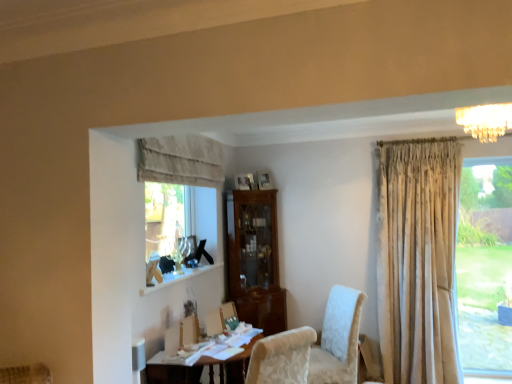
Question: Is wooden table at lower center positioned with its back to neutral fabric curtain at upper center?

Choices:
 (A) no
 (B) yes

Answer: (A)

Question: From the image's perspective, is wooden table at lower center under neutral fabric curtain at upper center?

Choices:
 (A) yes
 (B) no

Answer: (A)

Question: Is the depth of wooden table at lower center less than that of neutral fabric curtain at upper center?

Choices:
 (A) no
 (B) yes

Answer: (B)

Question: Can you confirm if wooden table at lower center is bigger than neutral fabric curtain at upper center?

Choices:
 (A) yes
 (B) no

Answer: (A)

Question: From a real-world perspective, is wooden table at lower center positioned under neutral fabric curtain at upper center based on gravity?

Choices:
 (A) yes
 (B) no

Answer: (A)

Question: Is wooden table at lower center wider or thinner than white textured chair at center?

Choices:
 (A) thin
 (B) wide

Answer: (B)

Question: Do you think wooden table at lower center is within white textured chair at center, or outside of it?

Choices:
 (A) inside
 (B) outside

Answer: (B)

Question: Relative to white textured chair at center, is wooden table at lower center in front or behind?

Choices:
 (A) behind
 (B) front

Answer: (B)

Question: Considering the positions of point (148, 382) and point (326, 332), is point (148, 382) closer or farther from the camera than point (326, 332)?

Choices:
 (A) closer
 (B) farther

Answer: (A)

Question: From their relative heights in the image, would you say neutral fabric curtain at upper center is taller or shorter than wooden table at lower center?

Choices:
 (A) tall
 (B) short

Answer: (B)

Question: Is point (139, 147) closer or farther from the camera than point (179, 380)?

Choices:
 (A) farther
 (B) closer

Answer: (A)

Question: Visually, is neutral fabric curtain at upper center positioned to the left or to the right of wooden table at lower center?

Choices:
 (A) right
 (B) left

Answer: (B)

Question: Considering the positions of neutral fabric curtain at upper center and wooden table at lower center in the image, is neutral fabric curtain at upper center bigger or smaller than wooden table at lower center?

Choices:
 (A) big
 (B) small

Answer: (B)

Question: Is crystal chandelier at upper right taller or shorter than wooden table at lower center?

Choices:
 (A) short
 (B) tall

Answer: (A)

Question: Does point (501, 132) appear closer or farther from the camera than point (241, 355)?

Choices:
 (A) closer
 (B) farther

Answer: (B)